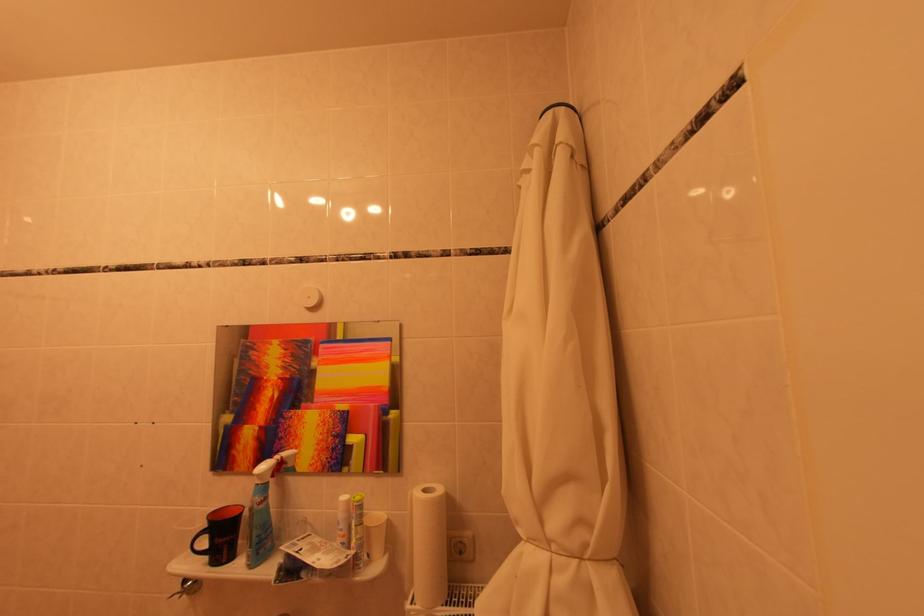
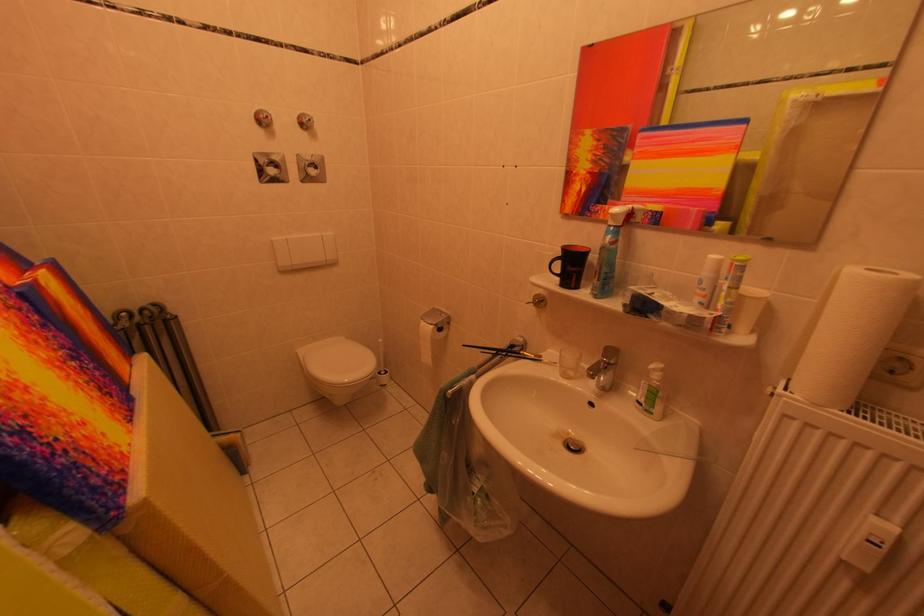
In the second image, find the point that corresponds to (370,543) in the first image.

(739, 307)